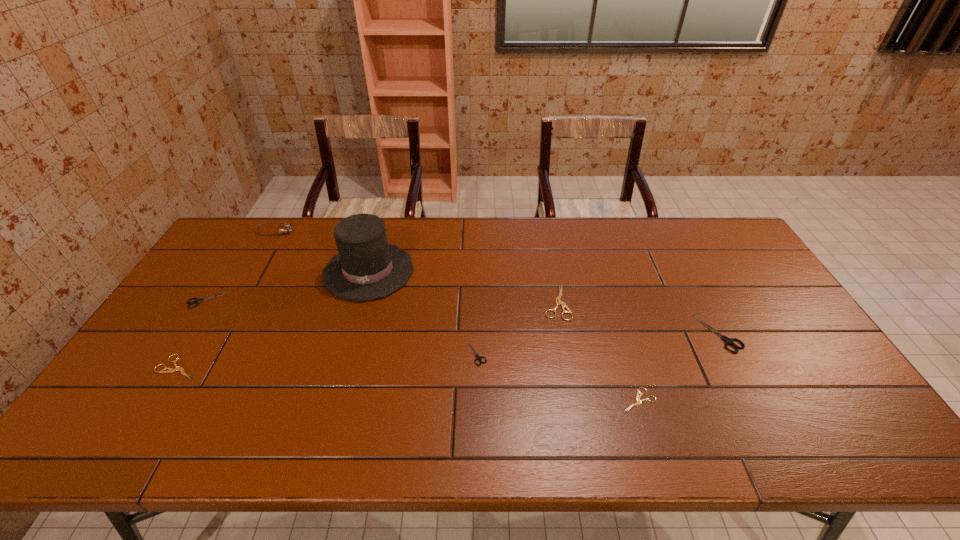
Locate an element on the screen. This screenshot has width=960, height=540. beige shears that stands as the third closest to the fourth object from right to left is located at coordinates (170, 370).

Identify which beige shears is the third nearest to the second black shears from left to right. Please provide its 2D coordinates. Your answer should be formatted as a tuple, i.e. [(x, y)], where the tuple contains the x and y coordinates of a point satisfying the conditions above.

[(170, 370)]

Locate an element on the screen. The width and height of the screenshot is (960, 540). vacant area in the image that satisfies the following two spatial constraints: 1. on the front side of the second beige shears from right to left; 2. on the left side of the rightmost object is located at coordinates (562, 334).

The width and height of the screenshot is (960, 540). I want to click on vacant position in the image that satisfies the following two spatial constraints: 1. on the front of the dress hat with the decoration; 2. on the left side of the second black shears from left to right, so click(346, 353).

Locate an element on the screen. This screenshot has height=540, width=960. vacant region that satisfies the following two spatial constraints: 1. on the front of the dress hat with the decoration; 2. on the right side of the third object from right to left is located at coordinates (360, 302).

The image size is (960, 540). Identify the location of free location that satisfies the following two spatial constraints: 1. on the front lenses and sides of the farthest object; 2. on the back side of the biggest black shears. (216, 334).